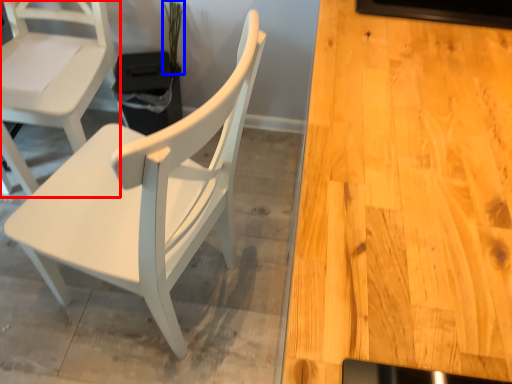
Question: Which point is further to the camera, chair (highlighted by a red box) or plant (highlighted by a blue box)?

Choices:
 (A) chair
 (B) plant

Answer: (B)